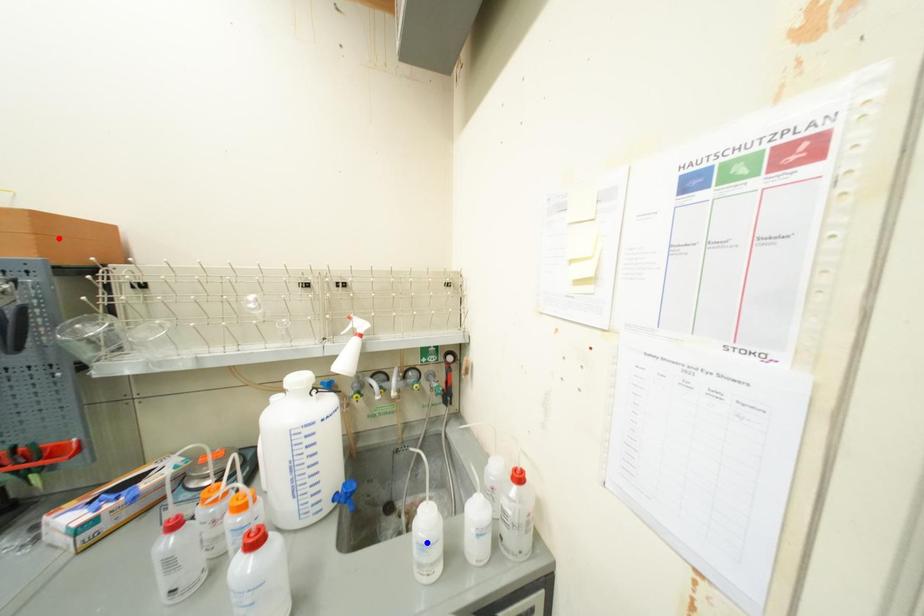
Question: In the image, two points are highlighted. Which point is nearer to the camera? Reply with the corresponding letter.

Choices:
 (A) blue point
 (B) red point

Answer: (B)